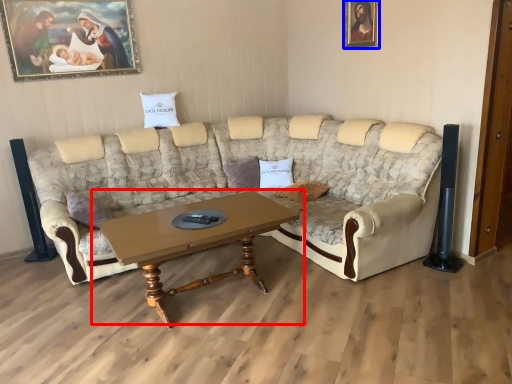
Question: Which of the following is the farthest to the observer, coffee table (highlighted by a red box) or picture frame (highlighted by a blue box)?

Choices:
 (A) coffee table
 (B) picture frame

Answer: (B)